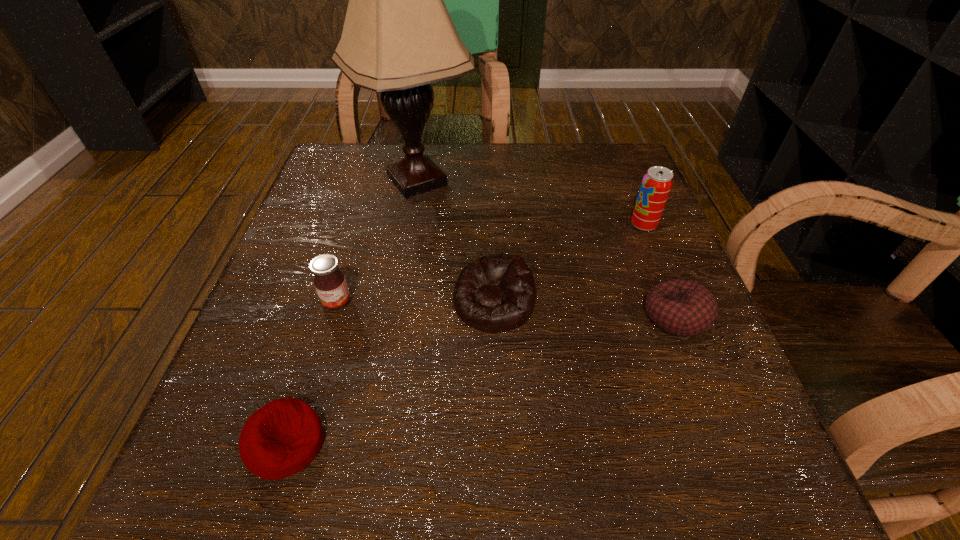
Locate an element on the screen. object located in the far left corner section of the desktop is located at coordinates pos(398,37).

Where is `object that is at the near left corner`? object that is at the near left corner is located at coordinates (281, 438).

This screenshot has height=540, width=960. I want to click on vacant region at the far edge of the desktop, so click(485, 164).

This screenshot has height=540, width=960. Identify the location of free space at the left edge of the desktop. [294, 365].

The height and width of the screenshot is (540, 960). I want to click on free space at the right edge of the desktop, so click(735, 395).

The image size is (960, 540). In order to click on vacant space at the far left corner of the desktop in this screenshot , I will do `click(361, 148)`.

The width and height of the screenshot is (960, 540). In order to click on vacant position at the far right corner of the desktop in this screenshot , I will do `click(565, 150)`.

In the image, there is a desktop. Identify the location of vacant space at the near right corner. (706, 489).

Where is `free space between the nearest beanbag and the second beanbag from left to right`? free space between the nearest beanbag and the second beanbag from left to right is located at coordinates (390, 373).

This screenshot has height=540, width=960. Identify the location of empty space that is in between the lamp and the fourth shortest object. click(377, 241).